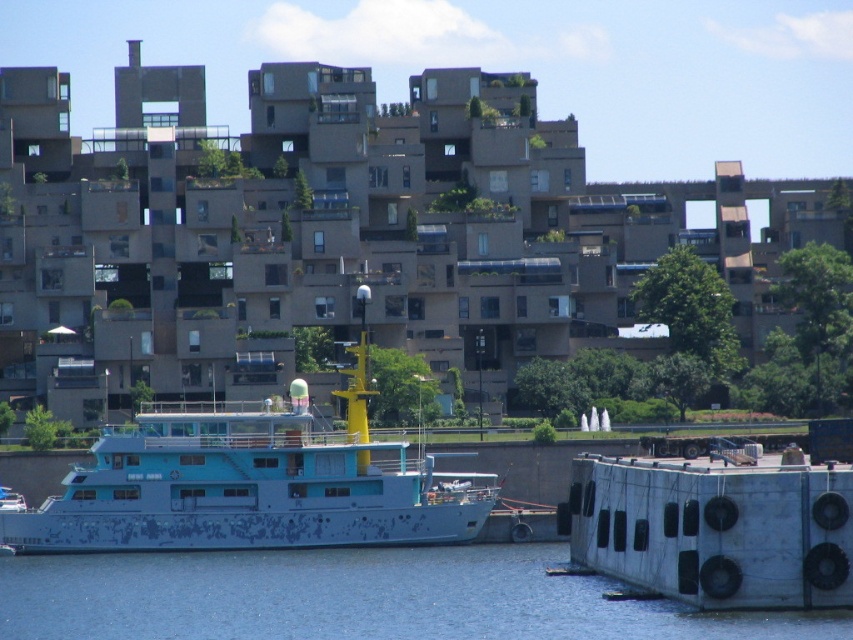
Measure the distance from blue water at lower center to blue faded paint boat at center.

blue water at lower center and blue faded paint boat at center are 29.06 feet apart.

Describe the element at coordinates (355, 598) in the screenshot. I see `blue water at lower center` at that location.

What do you see at coordinates (355, 598) in the screenshot?
I see `blue water at lower center` at bounding box center [355, 598].

I want to click on blue water at lower center, so click(x=355, y=598).